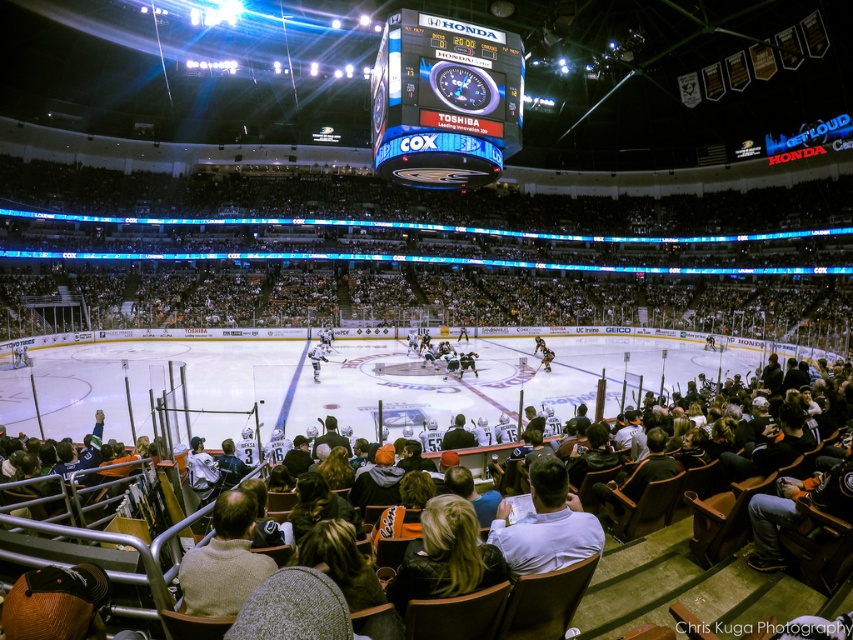
You are a photographer positioned at the camera location. You want to capture a photo of the point at coordinates point [428,346]. The arena has a rule that photos must be taken from at least 40 meters away. Will your current position allow you to comply with this rule?

The point at coordinates point [428,346] is 39.68 meters away from the camera. Since 39.68 meters is less than the required 40 meters, the photographer cannot comply with the arena rule from the current position.

You are a photographer trying to capture a clear shot of the players during the ice hockey game. You notice two white items at the center of the rink. Which one is more likely to be the player wearing the white matte jersey at center, given that the white shirt at center is thinner?

The white matte jersey at center is thicker than the white shirt at center, so the thicker item in the photo would be the white matte jersey at center.

You are a photographer positioned at the center of the arena. You want to capture a close shot of the white matte jersey at center. Based on its position, can you estimate how far to the right or left you need to move to frame it properly?

The white matte jersey at center is located at point coordinates approximately 0.559 along the horizontal axis and 0.506 vertically. Since the jersey is slightly to the right of the exact center horizontally, you should move slightly to the right to frame it properly.